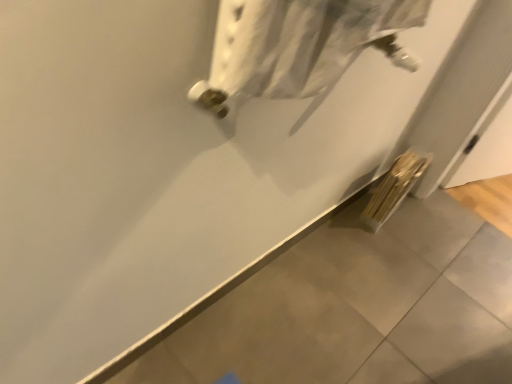
At what (x,y) coordinates should I click in order to perform the action: click on free location in front of wooden sticks at lower right. Please return your answer as a coordinate pair (x, y). This screenshot has height=384, width=512. Looking at the image, I should click on (387, 245).